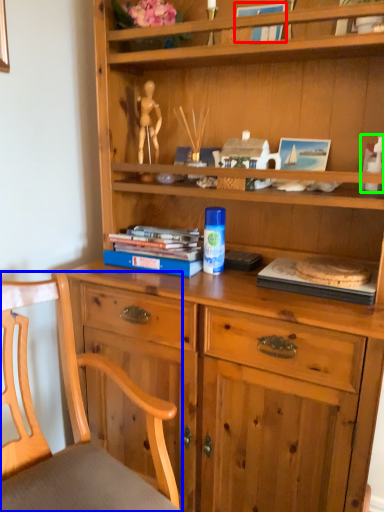
Question: Based on their relative distances, which object is nearer to book (highlighted by a red box)? Choose from chair (highlighted by a blue box) and toy (highlighted by a green box).

Choices:
 (A) chair
 (B) toy

Answer: (B)